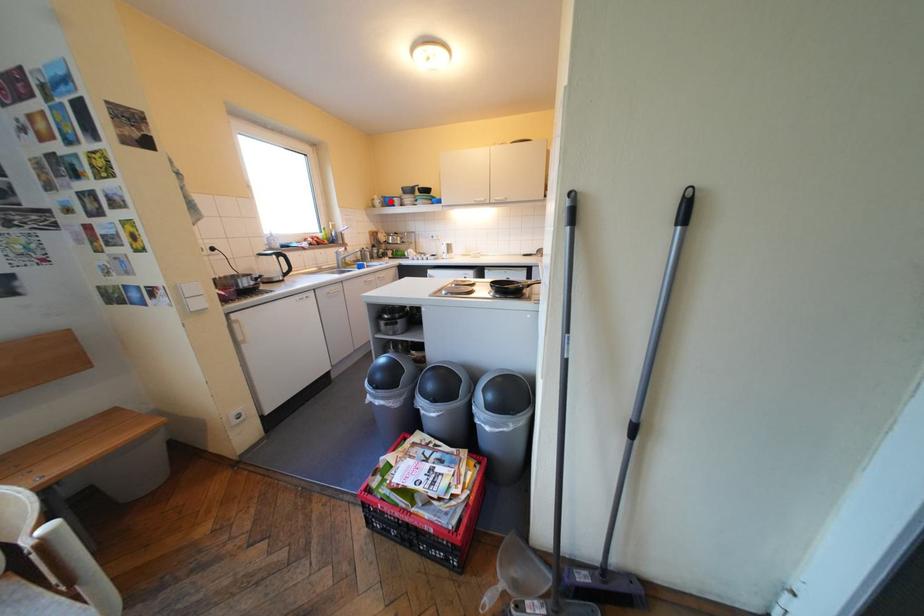
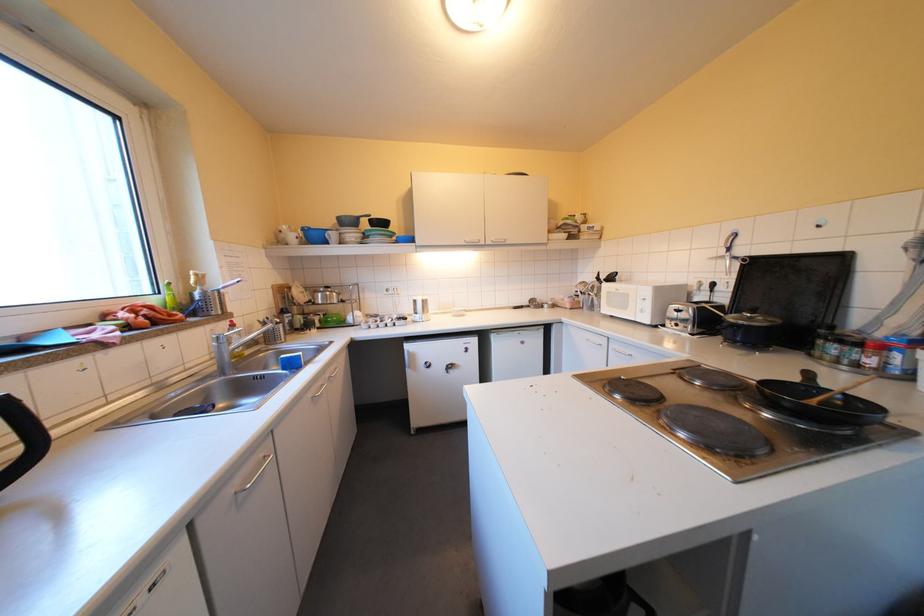
Question: A red point is marked in image1. In image2, is the corresponding 3D point closer to the camera or farther? Reply with the corresponding letter.

Choices:
 (A) The corresponding 3D point is closer.
 (B) The corresponding 3D point is farther.

Answer: (B)